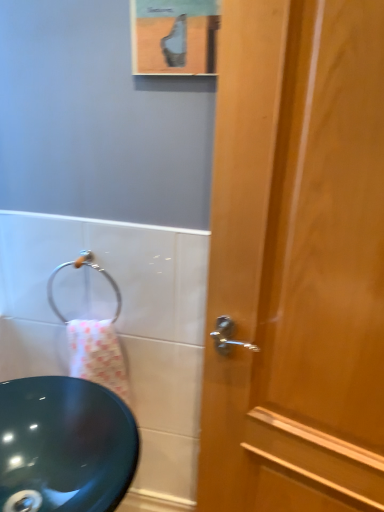
Question: Is matte black sink at left to the left of wooden door at right from the viewer's perspective?

Choices:
 (A) no
 (B) yes

Answer: (B)

Question: Is matte black sink at left positioned behind wooden door at right?

Choices:
 (A) yes
 (B) no

Answer: (A)

Question: Is matte black sink at left positioned in front of wooden door at right?

Choices:
 (A) no
 (B) yes

Answer: (A)

Question: Would you say matte black sink at left is a long distance from wooden door at right?

Choices:
 (A) no
 (B) yes

Answer: (A)

Question: Is matte black sink at left not inside wooden door at right?

Choices:
 (A) yes
 (B) no

Answer: (A)

Question: Is matte black sink at left to the right of wooden door at right from the viewer's perspective?

Choices:
 (A) no
 (B) yes

Answer: (A)

Question: Is wooden door at right oriented away from matte black sink at left?

Choices:
 (A) yes
 (B) no

Answer: (B)

Question: Is wooden door at right closer to camera compared to matte black sink at left?

Choices:
 (A) no
 (B) yes

Answer: (B)

Question: Would you say matte black sink at left is part of wooden door at right's contents?

Choices:
 (A) no
 (B) yes

Answer: (A)

Question: Can you confirm if wooden door at right is positioned to the right of matte black sink at left?

Choices:
 (A) yes
 (B) no

Answer: (A)

Question: Can you confirm if wooden door at right is positioned to the left of matte black sink at left?

Choices:
 (A) yes
 (B) no

Answer: (B)

Question: Can you confirm if wooden door at right is wider than matte black sink at left?

Choices:
 (A) no
 (B) yes

Answer: (B)

Question: From the image's perspective, is matte black sink at left located above silver metallic towel ring at lower left?

Choices:
 (A) yes
 (B) no

Answer: (B)